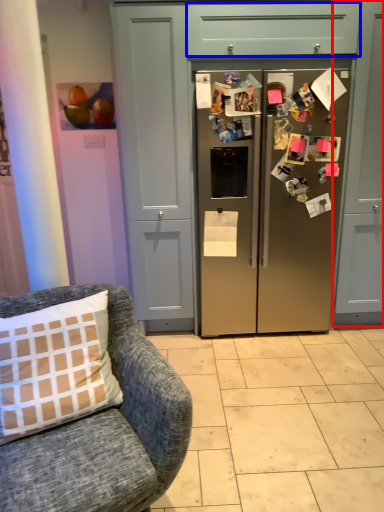
Question: Which of the following is the farthest to the observer, cabinetry (highlighted by a red box) or drawer (highlighted by a blue box)?

Choices:
 (A) cabinetry
 (B) drawer

Answer: (A)